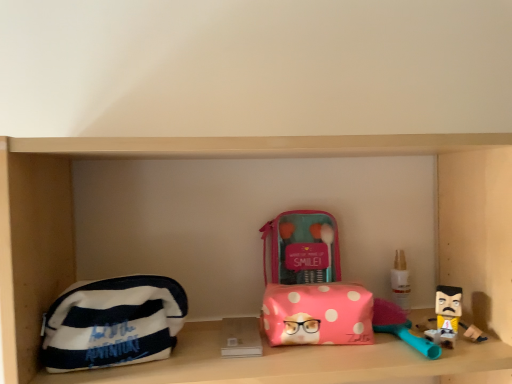
The height and width of the screenshot is (384, 512). What do you see at coordinates (113, 323) in the screenshot?
I see `white striped fabric pouch at left, the 1th pouch from the left` at bounding box center [113, 323].

I want to click on white plastic bottle at right, so click(x=400, y=281).

Is there a large distance between pink polka dot pouch at center, which is the first pouch in right-to-left order, and white striped fabric pouch at left, which ranks as the second pouch in right-to-left order?

Actually, pink polka dot pouch at center, which is the first pouch in right-to-left order, and white striped fabric pouch at left, which ranks as the second pouch in right-to-left order, are a little close together.

Is point (362, 314) closer to viewer compared to point (95, 285)?

No.

Considering the sizes of pink polka dot pouch at center, which is the first pouch in right-to-left order, and white striped fabric pouch at left, the 1th pouch from the left, in the image, is pink polka dot pouch at center, which is the first pouch in right-to-left order, wider or thinner than white striped fabric pouch at left, the 1th pouch from the left,?

Clearly, pink polka dot pouch at center, which is the first pouch in right-to-left order, has more width compared to white striped fabric pouch at left, the 1th pouch from the left.

From a real-world perspective, is pink polka dot pouch at center, which is the first pouch in right-to-left order, above or below white striped fabric pouch at left, which ranks as the second pouch in right-to-left order?

pink polka dot pouch at center, which is the first pouch in right-to-left order, is below white striped fabric pouch at left, which ranks as the second pouch in right-to-left order.

Which is nearer, (152, 353) or (298, 264)?

Point (152, 353) appears to be closer to the viewer than point (298, 264).

Can you tell me how much white striped fabric pouch at left, the 1th pouch from the left, and pink fabric makeup kit at center differ in facing direction?

The facing directions of white striped fabric pouch at left, the 1th pouch from the left, and pink fabric makeup kit at center are 8.2 degrees apart.

Which is behind, white striped fabric pouch at left, which ranks as the second pouch in right-to-left order, or pink fabric makeup kit at center?

pink fabric makeup kit at center is behind.

From the image's perspective, is white striped fabric pouch at left, which ranks as the second pouch in right-to-left order, located above pink fabric makeup kit at center?

No, from the image's perspective, white striped fabric pouch at left, which ranks as the second pouch in right-to-left order, is not on top of pink fabric makeup kit at center.

Is the position of pink fabric makeup kit at center more distant than that of white plastic bottle at right?

No, the depth of pink fabric makeup kit at center is less than that of white plastic bottle at right.

How much distance is there between pink fabric makeup kit at center and white plastic bottle at right?

pink fabric makeup kit at center is 8.01 inches from white plastic bottle at right.

Based on the photo, from the image's perspective, which one is positioned lower, pink fabric makeup kit at center or white plastic bottle at right?

From the image's view, white plastic bottle at right is below.

This screenshot has width=512, height=384. I want to click on toiletry below the pink fabric makeup kit at center (from a real-world perspective), so tap(400, 281).

Is pink polka dot pouch at center, which is the first pouch in right-to-left order, inside white plastic bottle at right?

No, white plastic bottle at right does not contain pink polka dot pouch at center, which is the first pouch in right-to-left order.

Which object is positioned more to the right, white plastic bottle at right or pink polka dot pouch at center, which ranks as the second pouch in left-to-right order?

white plastic bottle at right.

Does white plastic bottle at right have a greater width compared to pink polka dot pouch at center, which is the first pouch in right-to-left order?

No.

Is white striped fabric pouch at left, which ranks as the second pouch in right-to-left order, facing away from white plastic bottle at right?

No.

Is white striped fabric pouch at left, the 1th pouch from the left, not near white plastic bottle at right?

white striped fabric pouch at left, the 1th pouch from the left, is actually quite close to white plastic bottle at right.

Which is behind, point (150, 356) or point (403, 287)?

The point (403, 287) is more distant.

Between white striped fabric pouch at left, which ranks as the second pouch in right-to-left order, and white plastic bottle at right, which one has less height?

white plastic bottle at right is shorter.

Which is more to the left, white plastic bottle at right or pink fabric makeup kit at center?

From the viewer's perspective, pink fabric makeup kit at center appears more on the left side.

Are white plastic bottle at right and pink fabric makeup kit at center far apart?

No, white plastic bottle at right is not far away from pink fabric makeup kit at center.

Would you say white plastic bottle at right is outside pink fabric makeup kit at center?

Yes, white plastic bottle at right is located beyond the bounds of pink fabric makeup kit at center.

From a real-world perspective, is white striped fabric pouch at left, the 1th pouch from the left, over pink polka dot pouch at center, which is the first pouch in right-to-left order?

Correct, in the physical world, white striped fabric pouch at left, the 1th pouch from the left, is higher than pink polka dot pouch at center, which is the first pouch in right-to-left order.

How distant is white striped fabric pouch at left, the 1th pouch from the left, from pink polka dot pouch at center, which ranks as the second pouch in left-to-right order?

A distance of 9.68 inches exists between white striped fabric pouch at left, the 1th pouch from the left, and pink polka dot pouch at center, which ranks as the second pouch in left-to-right order.

Can you see white striped fabric pouch at left, the 1th pouch from the left, touching pink polka dot pouch at center, which is the first pouch in right-to-left order?

No, white striped fabric pouch at left, the 1th pouch from the left, is not in contact with pink polka dot pouch at center, which is the first pouch in right-to-left order.

Which object is closer to the camera taking this photo, white striped fabric pouch at left, the 1th pouch from the left, or pink polka dot pouch at center, which is the first pouch in right-to-left order?

white striped fabric pouch at left, the 1th pouch from the left, is more forward.

Image resolution: width=512 pixels, height=384 pixels. Identify the location of pouch behind the white striped fabric pouch at left, the 1th pouch from the left. (318, 314).

This screenshot has width=512, height=384. I want to click on kit above the white striped fabric pouch at left, which ranks as the second pouch in right-to-left order (from the image's perspective), so click(x=303, y=247).

Based on their spatial positions, is pink polka dot pouch at center, which ranks as the second pouch in left-to-right order, or white striped fabric pouch at left, the 1th pouch from the left, further from white plastic bottle at right?

white striped fabric pouch at left, the 1th pouch from the left, is further to white plastic bottle at right.

Estimate the real-world distances between objects in this image. Which object is further from pink fabric makeup kit at center, pink polka dot pouch at center, which is the first pouch in right-to-left order, or white plastic bottle at right?

white plastic bottle at right is positioned further to the anchor pink fabric makeup kit at center.

Considering their positions, is pink polka dot pouch at center, which is the first pouch in right-to-left order, positioned further to white plastic bottle at right than pink fabric makeup kit at center?

pink polka dot pouch at center, which is the first pouch in right-to-left order, is positioned further to the anchor white plastic bottle at right.

When comparing their distances from white striped fabric pouch at left, the 1th pouch from the left, does pink fabric makeup kit at center or pink polka dot pouch at center, which is the first pouch in right-to-left order, seem further?

Based on the image, pink fabric makeup kit at center appears to be further to white striped fabric pouch at left, the 1th pouch from the left.

Looking at the image, which one is located further to white striped fabric pouch at left, the 1th pouch from the left, pink polka dot pouch at center, which ranks as the second pouch in left-to-right order, or white plastic bottle at right?

The object further to white striped fabric pouch at left, the 1th pouch from the left, is white plastic bottle at right.

Based on their spatial positions, is white plastic bottle at right or pink fabric makeup kit at center further from white striped fabric pouch at left, the 1th pouch from the left?

white plastic bottle at right lies further to white striped fabric pouch at left, the 1th pouch from the left, than the other object.

Considering their positions, is pink polka dot pouch at center, which ranks as the second pouch in left-to-right order, positioned closer to white striped fabric pouch at left, which ranks as the second pouch in right-to-left order, than pink fabric makeup kit at center?

pink polka dot pouch at center, which ranks as the second pouch in left-to-right order, is closer to white striped fabric pouch at left, which ranks as the second pouch in right-to-left order.

Looking at the image, which one is located further to pink polka dot pouch at center, which ranks as the second pouch in left-to-right order, pink fabric makeup kit at center or white plastic bottle at right?

Based on the image, white plastic bottle at right appears to be further to pink polka dot pouch at center, which ranks as the second pouch in left-to-right order.

Where is `pouch situated between white striped fabric pouch at left, which ranks as the second pouch in right-to-left order, and white plastic bottle at right from left to right`? The height and width of the screenshot is (384, 512). pouch situated between white striped fabric pouch at left, which ranks as the second pouch in right-to-left order, and white plastic bottle at right from left to right is located at coordinates (318, 314).

The image size is (512, 384). Find the location of `kit between white striped fabric pouch at left, which ranks as the second pouch in right-to-left order, and white plastic bottle at right from left to right`. kit between white striped fabric pouch at left, which ranks as the second pouch in right-to-left order, and white plastic bottle at right from left to right is located at coordinates (303, 247).

What are the coordinates of `pouch situated between pink fabric makeup kit at center and white plastic bottle at right from left to right` in the screenshot? It's located at (318, 314).

I want to click on kit between white striped fabric pouch at left, the 1th pouch from the left, and pink polka dot pouch at center, which ranks as the second pouch in left-to-right order, so click(303, 247).